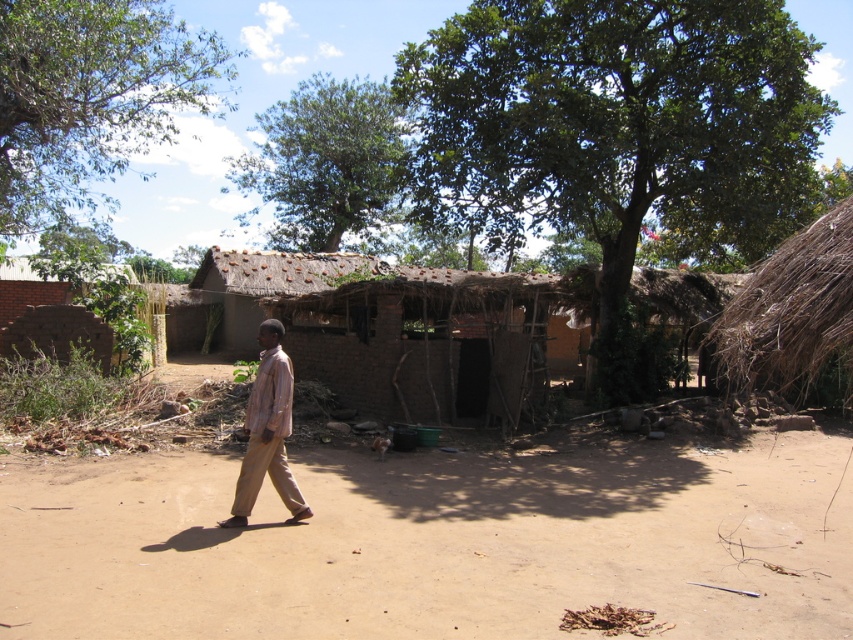
You are standing at the camera position and want to walk towards the brown dirt field at center. Which direction should you move in order to reach it?

Since the brown dirt field at center is located at point coordinates of [432,541], you should move forward from the camera position to reach it because the field is in the center of the image, which is directly ahead.